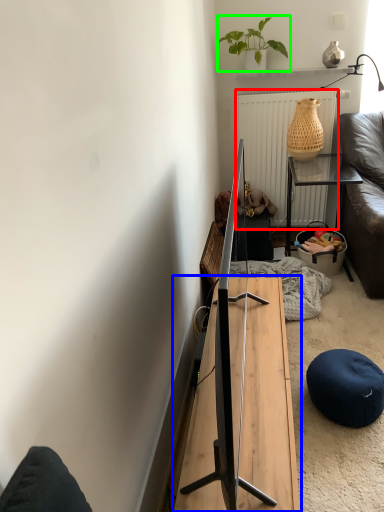
Question: Considering the real-world distances, which object is closest to radiator (highlighted by a red box)? table (highlighted by a blue box) or houseplant (highlighted by a green box).

Choices:
 (A) table
 (B) houseplant

Answer: (B)